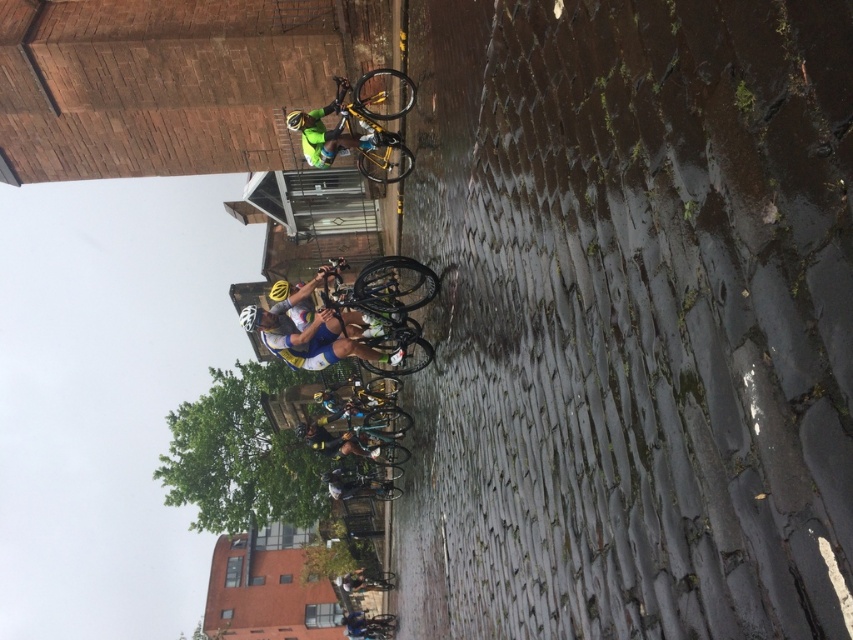
Between point (399, 76) and point (274, 296), which one is positioned in front?

Point (399, 76)

Which is more to the right, yellow metallic bicycle at upper center or yellow matte helmet at center?

yellow metallic bicycle at upper center

Identify the location of yellow metallic bicycle at upper center. (381, 122).

Does reflective yellow jacket at center appear over matte yellow helmet at center?

Yes.

Is the position of reflective yellow jacket at center more distant than that of matte yellow helmet at center?

No, it is in front of matte yellow helmet at center.

Who is more distant from viewer, (363, 138) or (305, 435)?

The point (305, 435) is more distant.

The image size is (853, 640). I want to click on reflective yellow jacket at center, so click(334, 132).

Is reflective yellow jacket at center smaller than white matte bicycle helmet at center?

Incorrect, reflective yellow jacket at center is not smaller in size than white matte bicycle helmet at center.

Is point (339, 124) closer to viewer compared to point (253, 330)?

Yes.

In order to click on reflective yellow jacket at center in this screenshot , I will do `click(334, 132)`.